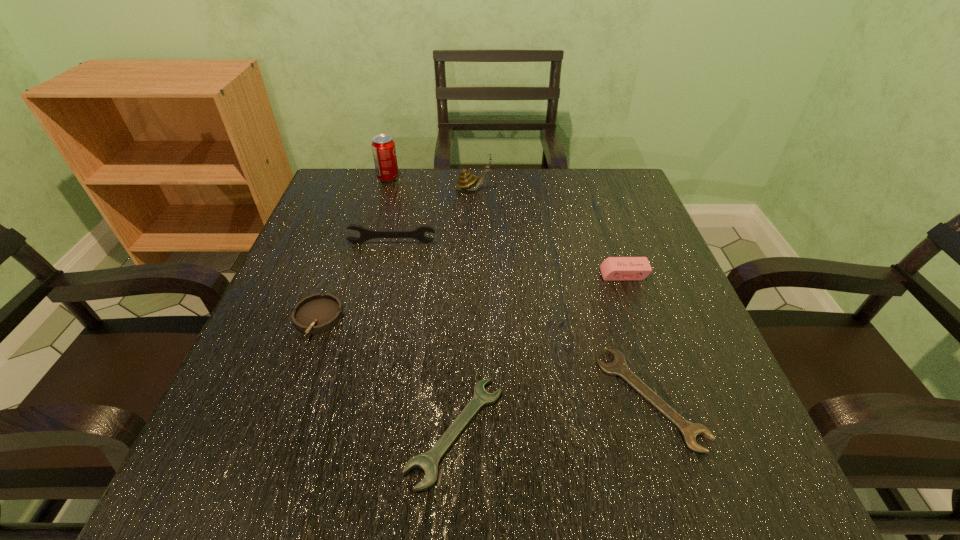
Locate an element on the screen. free space between the third nearest object and the tallest wrench is located at coordinates (355, 281).

Identify the location of vacant area between the tallest object and the fifth shortest object. The image size is (960, 540). (390, 211).

You are a GUI agent. You are given a task and a screenshot of the screen. Output one action in this format:
    pyautogui.click(x=<x>, y=<y>)
    Task: Click on the vacant area that lies between the rightmost wrench and the tallest wrench
    The width and height of the screenshot is (960, 540).
    Given the screenshot: What is the action you would take?
    pyautogui.click(x=521, y=320)

At what (x,y) coordinates should I click in order to perform the action: click on free space between the ashtray and the soda. Please return your answer as a coordinate pair (x, y). Image resolution: width=960 pixels, height=540 pixels. Looking at the image, I should click on (353, 248).

The image size is (960, 540). What are the coordinates of `free space between the ashtray and the soda` in the screenshot? It's located at (353, 248).

I want to click on free space between the ashtray and the farthest wrench, so click(x=355, y=281).

Find the location of a particular element. free space between the rightmost wrench and the second tallest object is located at coordinates (562, 293).

Image resolution: width=960 pixels, height=540 pixels. I want to click on vacant space in between the ashtray and the soda, so click(x=353, y=248).

At what (x,y) coordinates should I click in order to perform the action: click on free space between the snail and the rightmost wrench. Please return your answer as a coordinate pair (x, y). The width and height of the screenshot is (960, 540). Looking at the image, I should click on (562, 293).

This screenshot has width=960, height=540. Identify the location of object that is the second closest to the fourth tallest object. (428, 462).